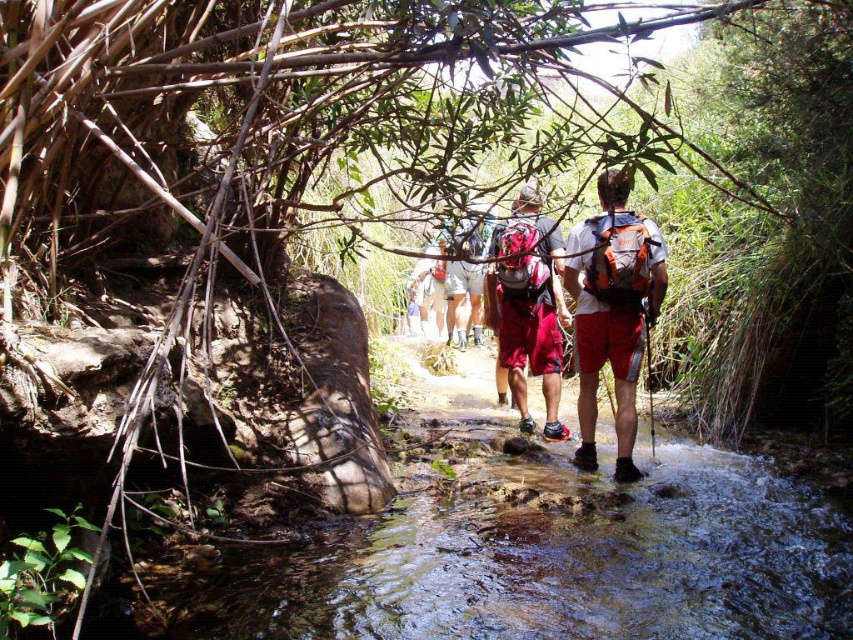
You are a hiker carrying a matte orange backpack at center and wearing matte red shorts at center. You want to check if your backpack is narrower than your shorts. Can you confirm this?

The matte orange backpack at center has a lesser width compared to matte red shorts at center, so yes, the backpack is narrower than the shorts.

You are a hiker who wants to place a water bottle on the ground near the matte orange backpack at center. Based on the scene description, where would be a suitable spot to place it?

The matte orange backpack at center is located at point (612, 310). A suitable spot would be near this coordinate, ensuring it stays on stable ground away from the flowing stream to avoid getting wet.

You are a photographer trying to capture the stream in the forest. You notice two points marked in the scene. Which of the two points, point (x=601, y=184) or point (x=527, y=234), is closer to your camera lens?

Point (x=601, y=184) is closer to the camera than point (x=527, y=234).